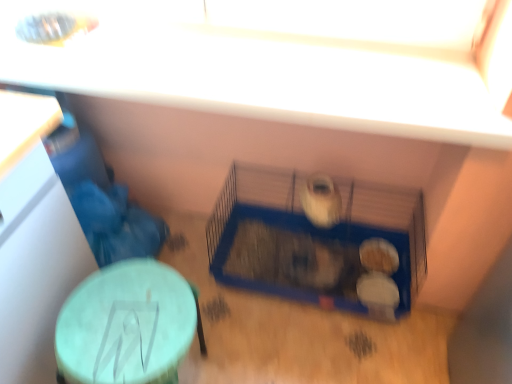
Question: Considering their positions, is blue wire bird cage at center located in front of or behind blue plastic cage at center?

Choices:
 (A) front
 (B) behind

Answer: (A)

Question: Is blue wire bird cage at center situated inside blue plastic cage at center or outside?

Choices:
 (A) inside
 (B) outside

Answer: (B)

Question: Considering the real-world distances, which object is closest to the blue plastic cage at center?

Choices:
 (A) blue wire bird cage at center
 (B) green matte table at lower left

Answer: (A)

Question: Which object is the closest to the green matte table at lower left?

Choices:
 (A) blue plastic cage at center
 (B) blue wire bird cage at center

Answer: (B)